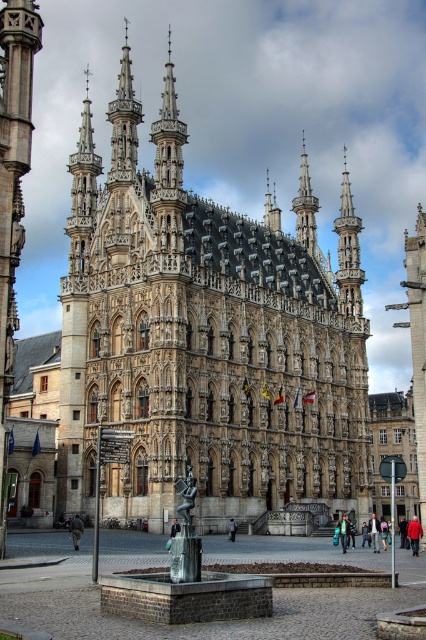
Based on the photo, which is below, stone gothic church at center or brick fountain at center?

brick fountain at center is below.

This screenshot has width=426, height=640. What do you see at coordinates (206, 339) in the screenshot?
I see `stone gothic church at center` at bounding box center [206, 339].

The image size is (426, 640). In order to click on stone gothic church at center in this screenshot , I will do `click(206, 339)`.